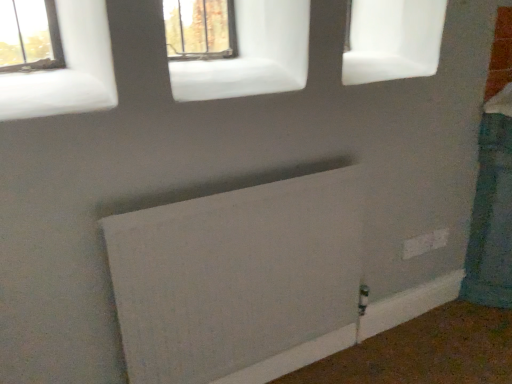
Question: Is white matte window at upper left, the 2th window positioned from the right, wider or thinner than matte glass window at upper center, the 1th window positioned from the right?

Choices:
 (A) wide
 (B) thin

Answer: (A)

Question: Is white matte window at upper left, the second window when ordered from top to bottom, inside the boundaries of matte glass window at upper center, the 1th window positioned from the right, or outside?

Choices:
 (A) outside
 (B) inside

Answer: (A)

Question: Estimate the real-world distances between objects in this image. Which object is farther from the matte glass window at upper center, the 2th window from the front?

Choices:
 (A) white matte radiator at lower center
 (B) white plastic electric outlet at lower right
 (C) white matte window at upper left, which ranks as the 2th window in back-to-front order

Answer: (A)

Question: Considering the real-world distances, which object is closest to the white matte window at upper left, the 1th window in the front-to-back sequence?

Choices:
 (A) white plastic electric outlet at lower right
 (B) matte glass window at upper center, which appears as the second window when viewed from the left
 (C) white matte radiator at lower center

Answer: (C)